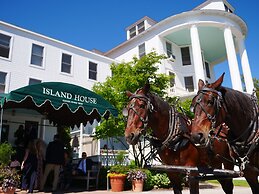
This screenshot has width=259, height=194. Identify the location of pillars. (234, 77), (249, 77).